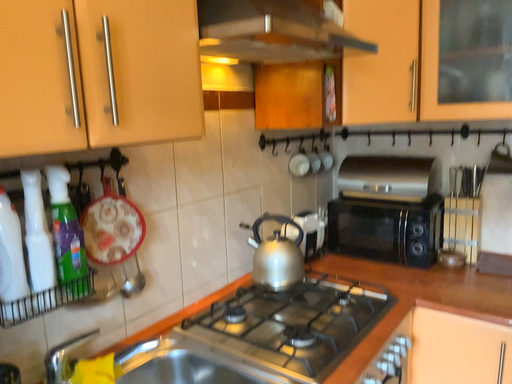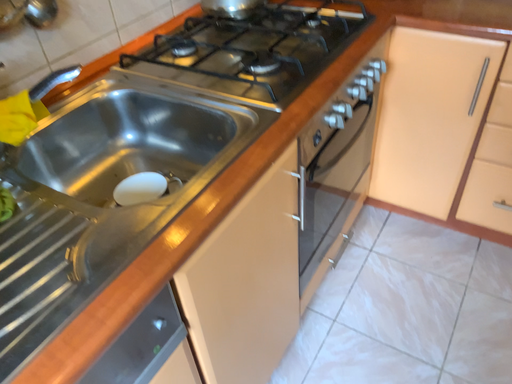
Question: How did the camera likely rotate when shooting the video?

Choices:
 (A) rotated downward
 (B) rotated upward

Answer: (A)